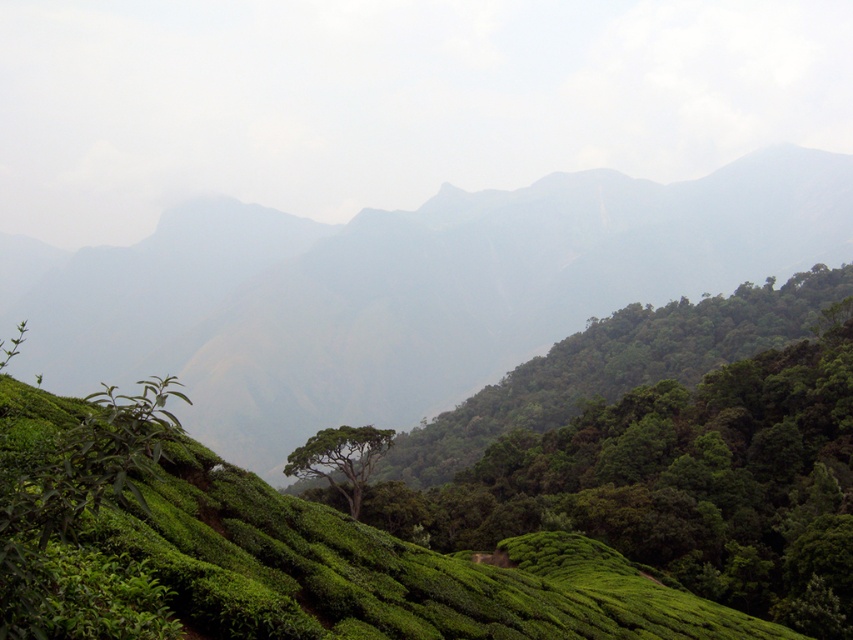
Question: Does green leafy hillside at center appear on the left side of green leafy tree at center?

Choices:
 (A) yes
 (B) no

Answer: (A)

Question: Is green leafy hillside at center below green leafy tree at center?

Choices:
 (A) yes
 (B) no

Answer: (B)

Question: Which of the following is the farthest from the observer?

Choices:
 (A) green leafy tree at center
 (B) green leafy hillside at center

Answer: (B)

Question: Does green leafy hillside at center lie in front of green leafy tree at center?

Choices:
 (A) no
 (B) yes

Answer: (A)

Question: Which point is closer to the camera taking this photo?

Choices:
 (A) (326, 468)
 (B) (601, 284)

Answer: (A)